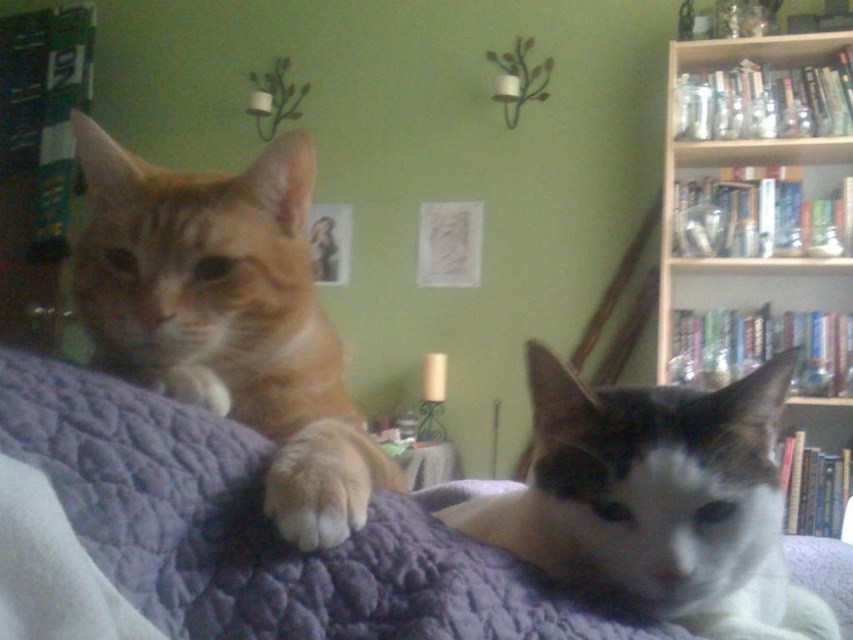
Question: In this image, where is wooden bookshelf at upper right located relative to white fur cat at center?

Choices:
 (A) right
 (B) left

Answer: (A)

Question: Does purple quilted bed at center appear over wooden bookshelf at upper right?

Choices:
 (A) no
 (B) yes

Answer: (A)

Question: Can you confirm if purple quilted bed at center is bigger than white fur cat at center?

Choices:
 (A) no
 (B) yes

Answer: (A)

Question: Which object is farther from the camera taking this photo?

Choices:
 (A) wooden bookshelf at upper right
 (B) purple quilted bed at center

Answer: (A)

Question: Among these points, which one is nearest to the camera?

Choices:
 (A) (276, 451)
 (B) (674, 532)
 (C) (155, 499)

Answer: (C)

Question: Based on their relative distances, which object is farther from the wooden bookshelf at upper right?

Choices:
 (A) orange fur cat at left
 (B) white fur cat at center

Answer: (A)